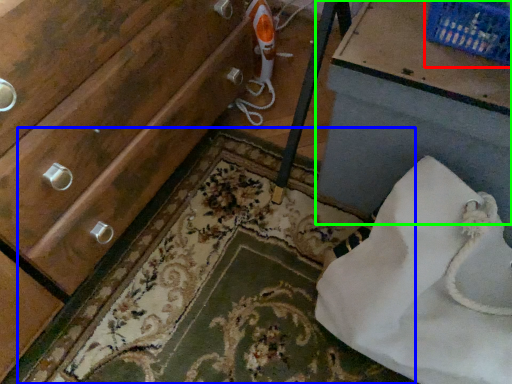
Question: Estimate the real-world distances between objects in this image. Which object is closer to basket (highlighted by a red box), bath mat (highlighted by a blue box) or vanity (highlighted by a green box)?

Choices:
 (A) bath mat
 (B) vanity

Answer: (B)